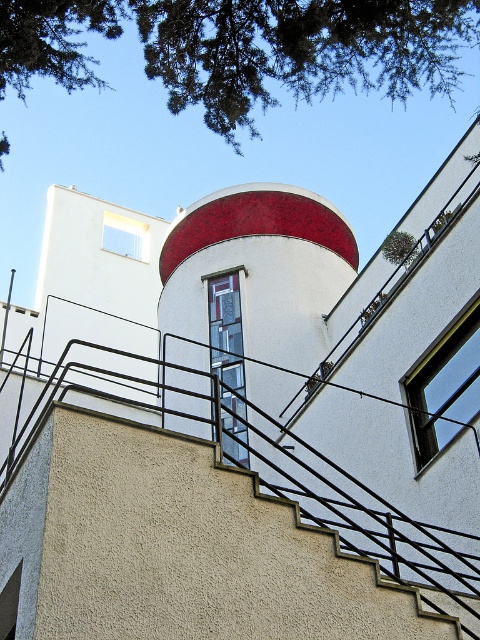
Question: From the image, what is the correct spatial relationship of green leafy tree at upper left in relation to clear glass window at center?

Choices:
 (A) below
 (B) above

Answer: (B)

Question: Which object appears closest to the camera in this image?

Choices:
 (A) smooth red tower at center
 (B) green leafy tree at upper left

Answer: (A)

Question: Is green leafy tree at upper left thinner than clear glass window at center?

Choices:
 (A) no
 (B) yes

Answer: (A)

Question: Based on their relative distances, which object is farther from the clear glass window at center?

Choices:
 (A) clear glass window at upper center
 (B) green leafy tree at upper left

Answer: (A)

Question: Can you confirm if green leafy tree at upper left is thinner than smooth red tower at center?

Choices:
 (A) yes
 (B) no

Answer: (B)

Question: Which of the following is the farthest from the observer?

Choices:
 (A) green leafy tree at upper left
 (B) smooth red tower at center
 (C) clear glass window at upper center

Answer: (C)